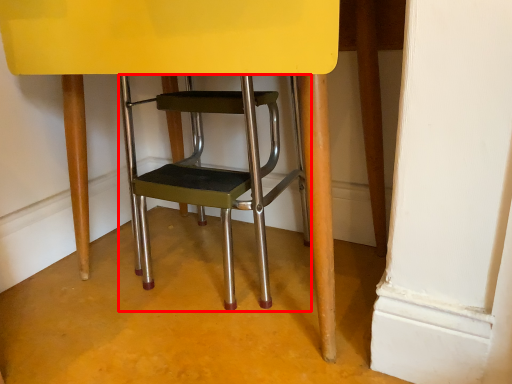
Question: Where is stool (annotated by the red box) located in relation to chair in the image?

Choices:
 (A) left
 (B) right

Answer: (A)